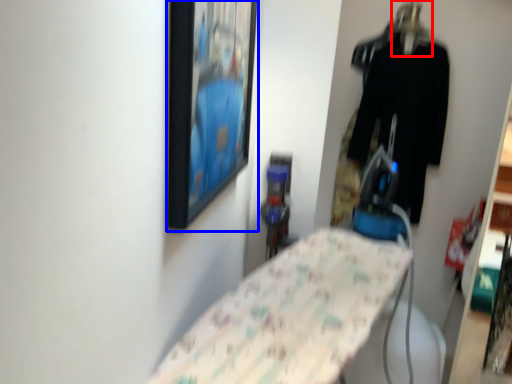
Question: Which object appears closest to the camera in this image, hanger (highlighted by a red box) or picture frame (highlighted by a blue box)?

Choices:
 (A) hanger
 (B) picture frame

Answer: (B)